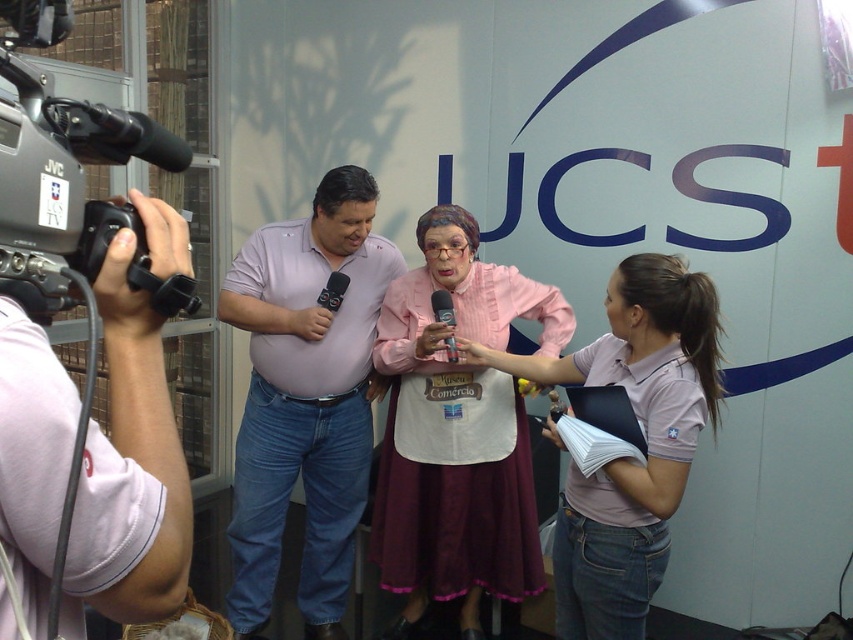
What are the coordinates of the light purple shirt at center?

The coordinates of the light purple shirt at center are at point (x=305, y=397).

You are an event planner who needs to place a small table for refreshments. The table must be positioned such that it is equidistant from the JVC camera on the left and the pink fabric dress at center. Where should you place the table in terms of coordinates?

The table should be placed at the midpoint between the JVC camera on the left and the pink fabric dress at center. Since the pink fabric dress at center is at point (457, 432), and the JVC camera is on the left, the midpoint coordinates would depend on the camera position. However, without exact coordinates for the camera, an approximate midpoint might be around (229, 216) assuming the camera is at (0, 0). But since the camera is on the left edge, the exact coordinates can be calculated once its position

You are a photographer at the event and want to take a photo of both the light purple shirt at center and the pink cotton shirt at center. To ensure both shirts are in the frame, should you position your camera to the left or right of the two shirts?

You should position your camera to the right of the light purple shirt at center and pink cotton shirt at center because the light purple shirt at center is to the left of pink cotton shirt at center, so facing right would capture both shirts in the frame.